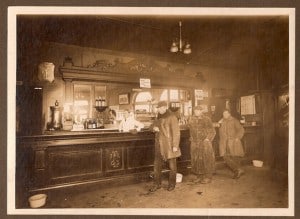
Locate an element on the screen. This screenshot has height=219, width=300. bowls is located at coordinates (35, 203), (178, 178), (259, 164).